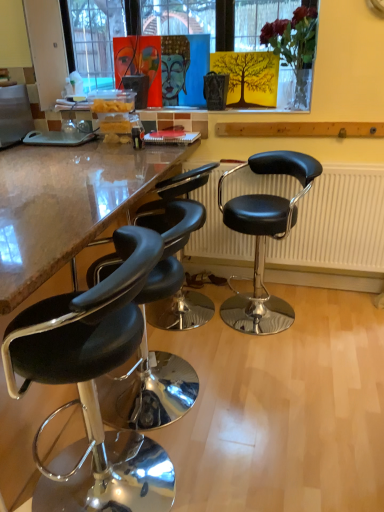
Question: Considering the positions of black leather stool at lower left, arranged as the second chair when viewed from the left, and black leather stool at right, placed as the first chair when sorted from right to left, in the image, is black leather stool at lower left, arranged as the second chair when viewed from the left, taller or shorter than black leather stool at right, placed as the first chair when sorted from right to left,?

Choices:
 (A) short
 (B) tall

Answer: (A)

Question: Considering the positions of black leather stool at lower left, arranged as the second chair when viewed from the left, and black leather stool at right, placed as the first chair when sorted from right to left, in the image, is black leather stool at lower left, arranged as the second chair when viewed from the left, bigger or smaller than black leather stool at right, placed as the first chair when sorted from right to left,?

Choices:
 (A) small
 (B) big

Answer: (A)

Question: Estimate the real-world distances between objects in this image. Which object is farther from the black leather radiator at center?

Choices:
 (A) black leather stool at right, placed as the first chair when sorted from right to left
 (B) black leather stool at left, which ranks as the 1th chair in left-to-right order
 (C) black leather stool at lower left, arranged as the second chair when viewed from the left
 (D) black leather stool at left, marked as the 3th chair in a left-to-right arrangement

Answer: (B)

Question: Considering the real-world distances, which object is closest to the black leather stool at left, which is counted as the second chair, starting from the right?

Choices:
 (A) black leather stool at lower left, arranged as the second chair when viewed from the left
 (B) black leather radiator at center
 (C) black leather stool at left, which ranks as the 1th chair in left-to-right order
 (D) black leather stool at right, placed as the 4th chair when sorted from left to right

Answer: (B)